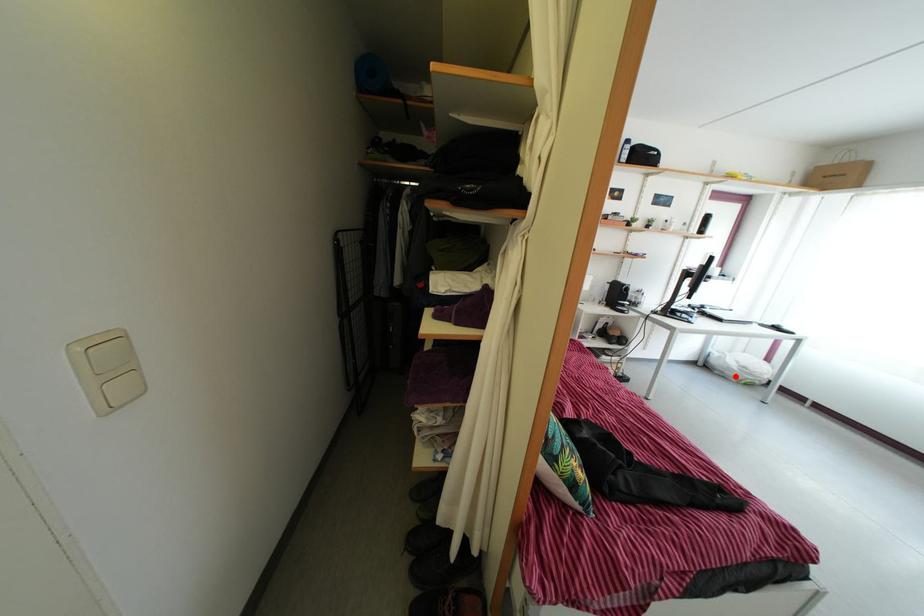
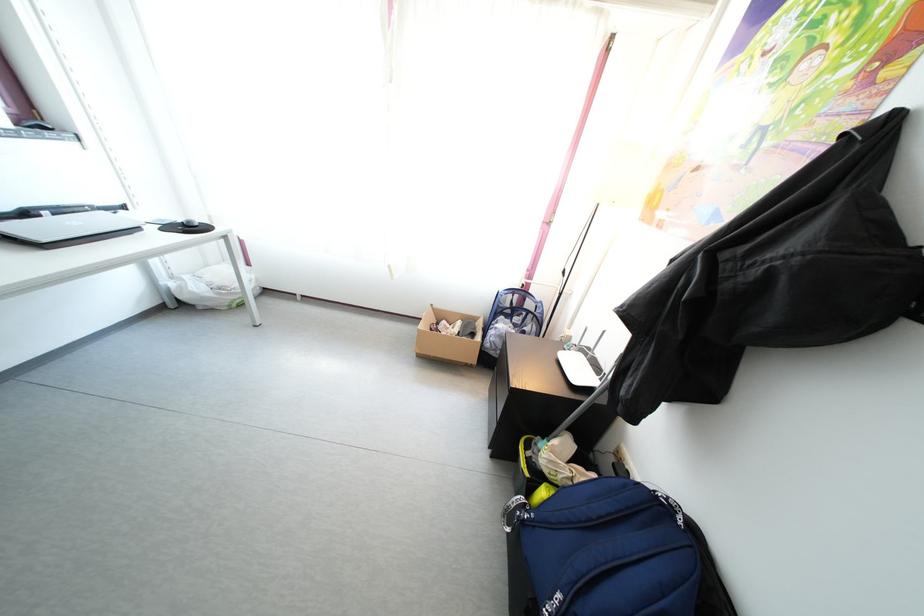
Question: A red point is marked in image1. In image2, is the corresponding 3D point closer to the camera or farther? Reply with the corresponding letter.

Choices:
 (A) The corresponding 3D point is closer.
 (B) The corresponding 3D point is farther.

Answer: (B)